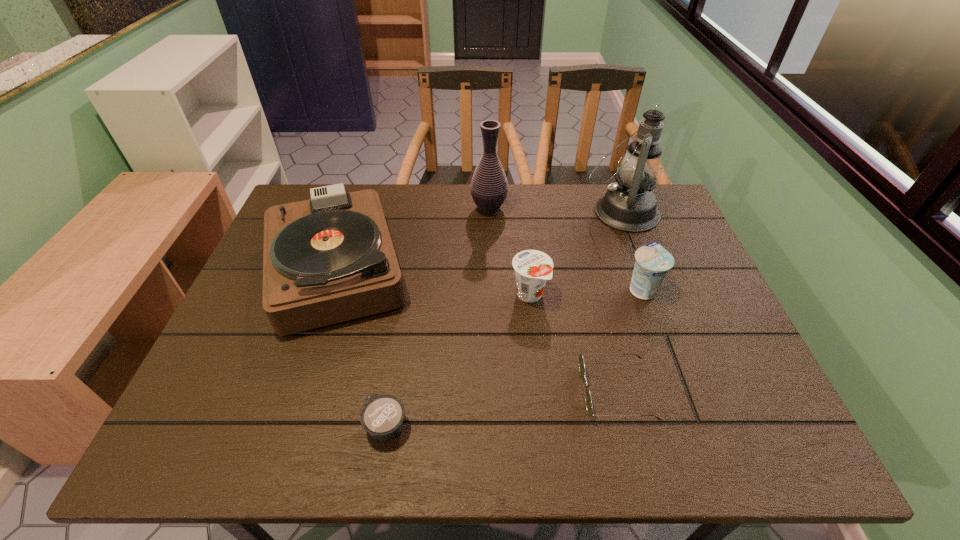
This screenshot has height=540, width=960. Identify the location of the tallest object. (629, 205).

I want to click on vase, so click(x=489, y=187).

Where is `record player`? This screenshot has width=960, height=540. record player is located at coordinates (329, 259).

Where is `the rightmost yogurt`? Image resolution: width=960 pixels, height=540 pixels. the rightmost yogurt is located at coordinates (652, 263).

Image resolution: width=960 pixels, height=540 pixels. I want to click on the second yogurt from left to right, so click(533, 268).

This screenshot has width=960, height=540. I want to click on sunglasses, so click(589, 407).

Identify the location of the leftmost yogurt. (382, 416).

At what (x,y) coordinates should I click in order to perform the action: click on the nearest yogurt. Please return your answer as a coordinate pair (x, y). The height and width of the screenshot is (540, 960). Looking at the image, I should click on (382, 416).

The image size is (960, 540). I want to click on vacant space situated 0.140m on the left of the tallest object, so click(x=539, y=212).

Identify the location of vacant area situated on the front of the vase. This screenshot has width=960, height=540. (490, 255).